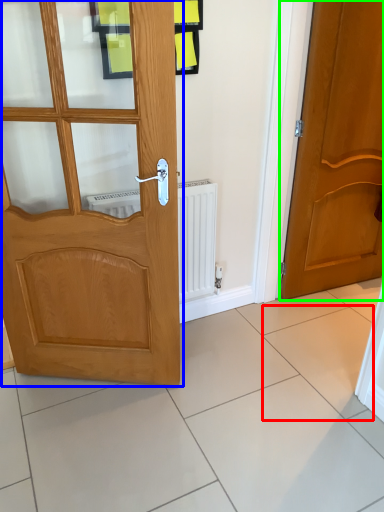
Question: Based on their relative distances, which object is farther from ceramic tile (highlighted by a red box)? Choose from door (highlighted by a blue box) and door (highlighted by a green box).

Choices:
 (A) door
 (B) door

Answer: (A)